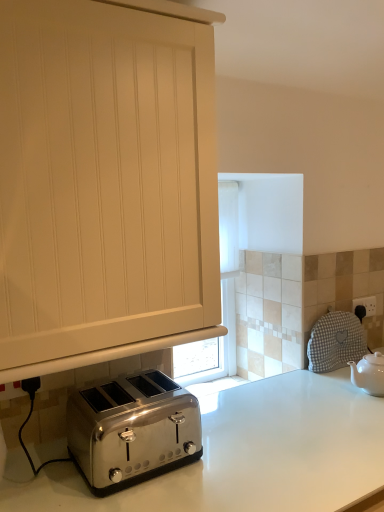
The image size is (384, 512). What are the coordinates of `free space above satin silver toaster at lower left (from a real-world perspective)` in the screenshot? It's located at (139, 392).